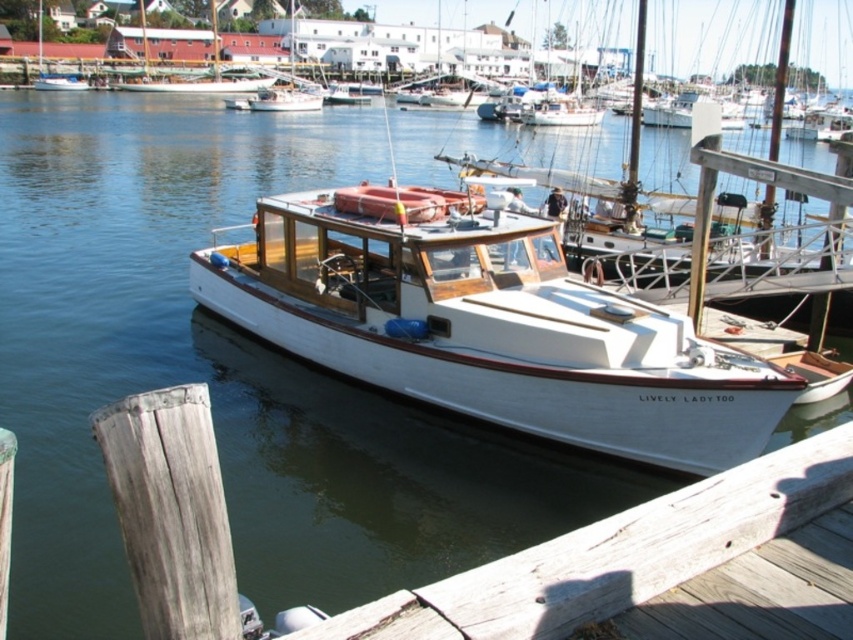
You are standing on the wooden planks at lower center and want to board the white glossy boat at center. Is the boat higher or lower than the planks you are currently on?

The wooden planks at lower center is not as tall as white glossy boat at center, so the boat is higher than the planks.

Consider the image. You are standing at the edge of the marina and want to take a photo of the point marked at coordinates (289,288). The camera you have can focus on objects up to 15 meters away. Will the point be in focus?

The point marked at coordinates (289,288) is 13.20 meters from the viewer, which is within the camera focus range of up to 15 meters. Therefore, the point will be in focus.

You are standing on the wooden pier looking out towards the water. You see the wooden planks at lower center and the white glossy boat at center. Which object is closer to you?

The wooden planks at lower center are closer to you than the white glossy boat at center.